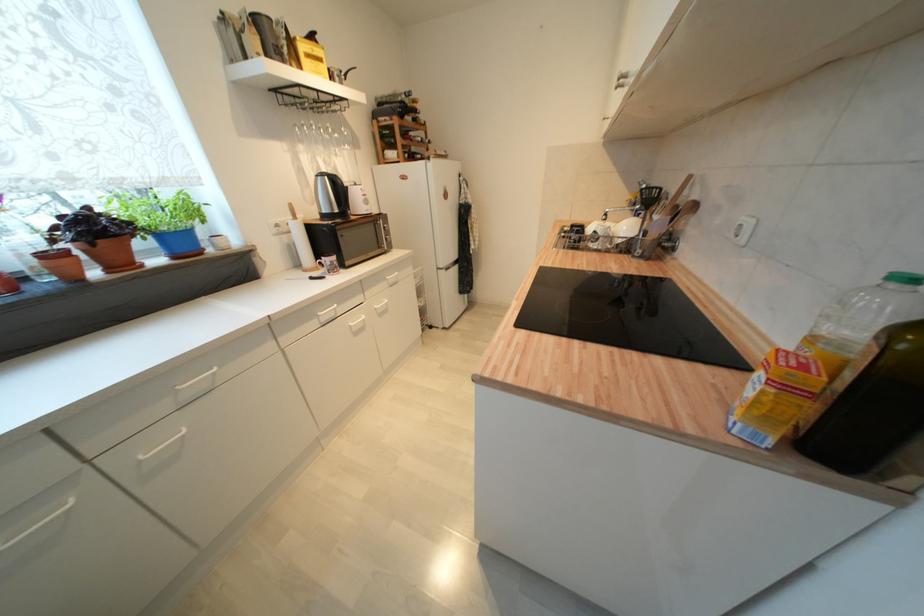
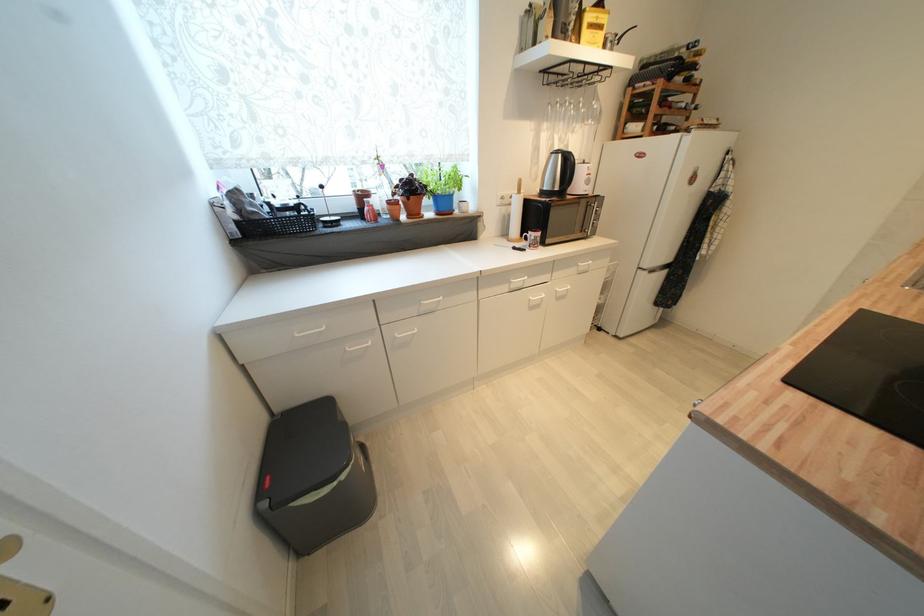
In the second image, find the point that corresponds to [323,318] in the first image.

(516, 284)